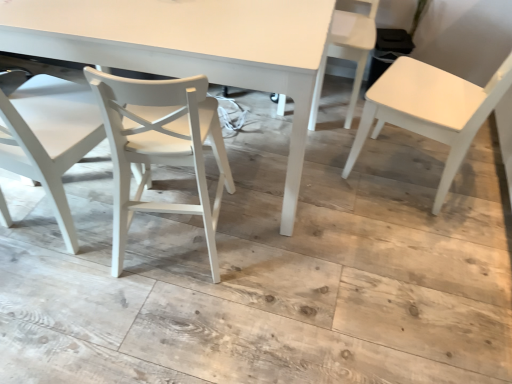
Where is `vacant space that is to the left of white matte chair at right, placed as the fourth chair when sorted from left to right`? Image resolution: width=512 pixels, height=384 pixels. vacant space that is to the left of white matte chair at right, placed as the fourth chair when sorted from left to right is located at coordinates (327, 186).